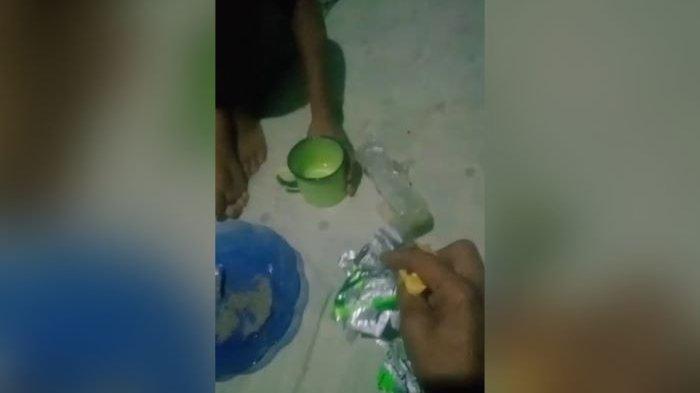
Locate an element on the screen. white floor is located at coordinates (314, 249), (437, 98).